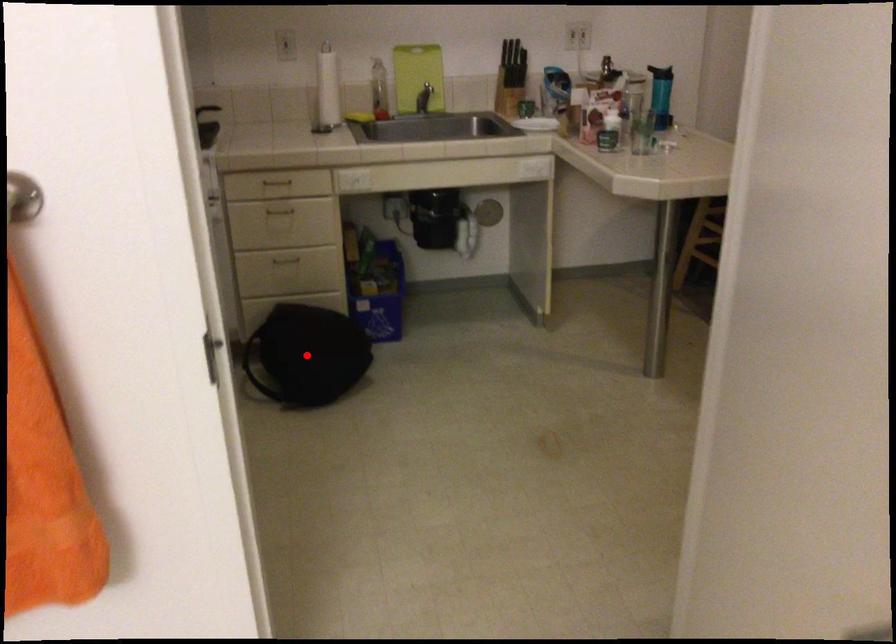
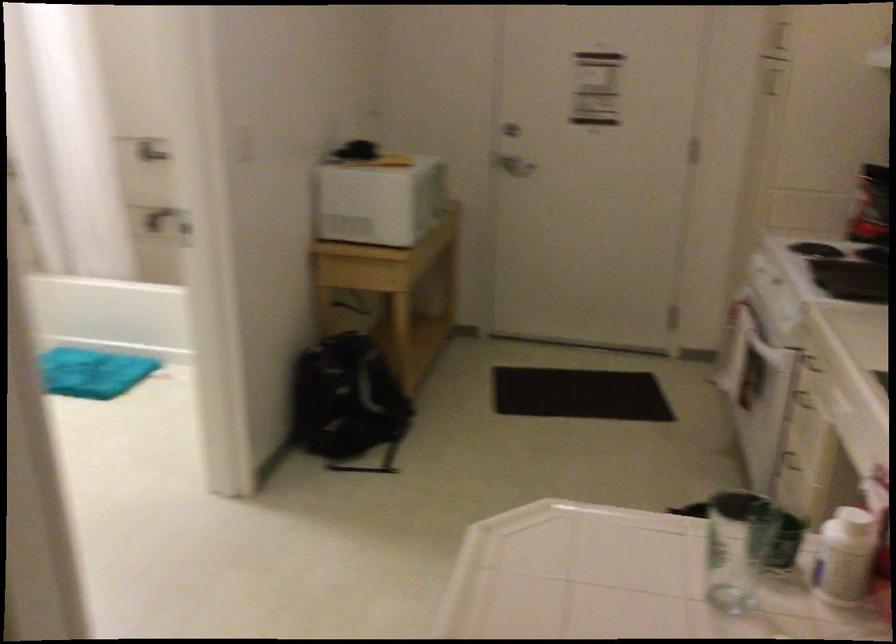
Question: I am providing you with two images of the same scene from different viewpoints. A red point is marked on the first image. Can you still see the location of the red point in image 2?

Choices:
 (A) Yes
 (B) No

Answer: (B)